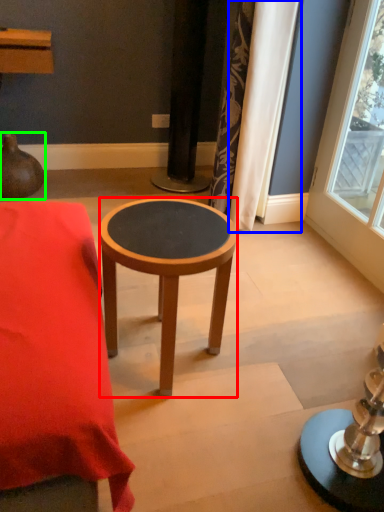
Question: Estimate the real-world distances between objects in this image. Which object is closer to stool (highlighted by a red box), curtain (highlighted by a blue box) or vase (highlighted by a green box)?

Choices:
 (A) curtain
 (B) vase

Answer: (A)